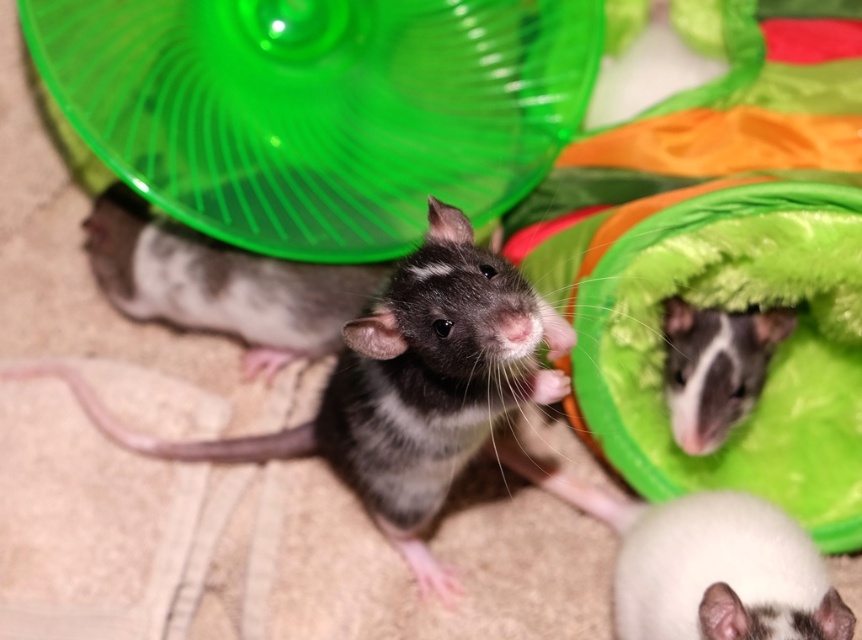
Is point (422, 474) less distant than point (746, 596)?

That is False.

Is black and white fur hamster at center positioned behind white soft hamster at lower right?

Yes, it is.

The height and width of the screenshot is (640, 862). In order to click on black and white fur hamster at center in this screenshot , I will do `click(404, 385)`.

Is point (713, 508) less distant than point (685, 308)?

Yes.

From the picture: Is white soft hamster at lower right wider than white fur mouse at upper right?

Yes, white soft hamster at lower right is wider than white fur mouse at upper right.

What are the coordinates of `white soft hamster at lower right` in the screenshot? It's located at pyautogui.click(x=698, y=560).

Locate an element on the screen. Image resolution: width=862 pixels, height=640 pixels. white soft hamster at lower right is located at coordinates (698, 560).

Which is above, black and white fur hamster at center or gray fur mouse at center?

Positioned higher is gray fur mouse at center.

Does point (533, 308) come closer to viewer compared to point (191, 259)?

Yes.

What do you see at coordinates (404, 385) in the screenshot? I see `black and white fur hamster at center` at bounding box center [404, 385].

The width and height of the screenshot is (862, 640). Find the location of `black and white fur hamster at center`. black and white fur hamster at center is located at coordinates point(404,385).